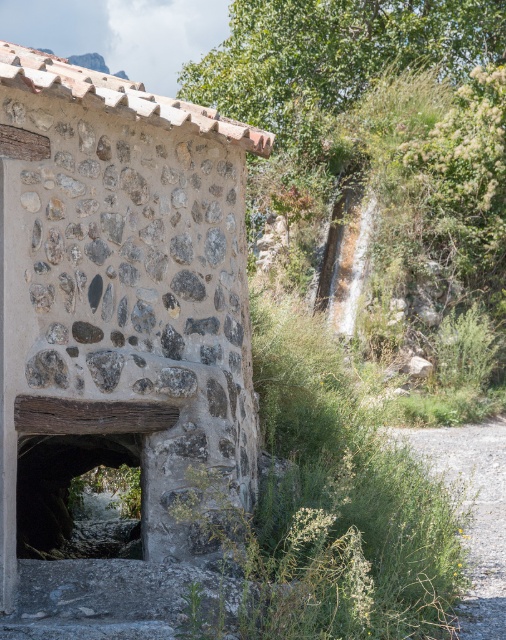
You are an explorer who wants to enter the rustic stone hut at center and the dark stone tunnel at center. Which entrance do you think requires more physical space to pass through comfortably?

The rustic stone hut at center is bigger than the dark stone tunnel at center, so the entrance to the rustic stone hut at center requires more physical space to pass through comfortably.

You are standing at the entrance of the rustic stone structure and want to move towards the dark interior. There are two points marked as point 1 and point 2. Point 1 is at coordinates (95, 413) and point 2 is at (116, 449). Which point should you aim for to reach the dark interior first?

Point 1 at (95, 413) is in front of point 2 at (116, 449), so aiming for point 1 would lead you closer to the dark interior first.